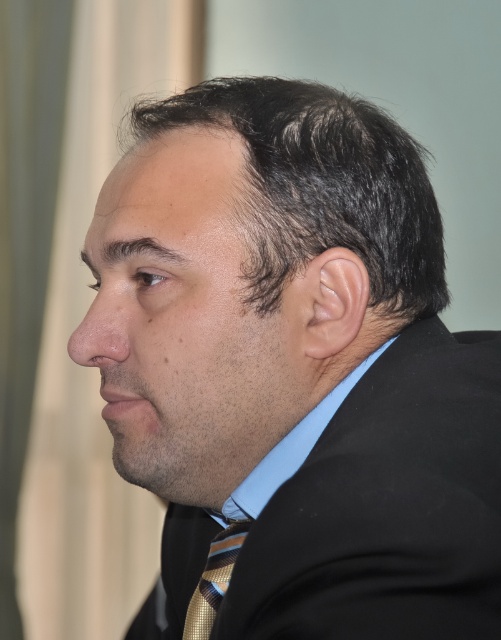
Can you confirm if dark brown hair at center is positioned above smooth skin ear at center?

Indeed, dark brown hair at center is positioned over smooth skin ear at center.

Can you confirm if dark brown hair at center is taller than smooth skin ear at center?

Correct, dark brown hair at center is much taller as smooth skin ear at center.

Locate an element on the screen. The height and width of the screenshot is (640, 501). dark brown hair at center is located at coordinates (321, 186).

At what (x,y) coordinates should I click in order to perform the action: click on dark brown hair at center. Please return your answer as a coordinate pair (x, y). Looking at the image, I should click on (321, 186).

Does smooth skin ear at center have a lesser width compared to striped silk tie at center?

Correct, smooth skin ear at center's width is less than striped silk tie at center's.

The width and height of the screenshot is (501, 640). What do you see at coordinates (335, 301) in the screenshot?
I see `smooth skin ear at center` at bounding box center [335, 301].

Image resolution: width=501 pixels, height=640 pixels. What are the coordinates of `smooth skin ear at center` in the screenshot? It's located at (335, 301).

Is the position of smooth skin nose at center more distant than that of striped silk tie at center?

No, smooth skin nose at center is closer to the viewer.

What do you see at coordinates (102, 332) in the screenshot? I see `smooth skin nose at center` at bounding box center [102, 332].

Where is `smooth skin nose at center`? Image resolution: width=501 pixels, height=640 pixels. smooth skin nose at center is located at coordinates click(102, 332).